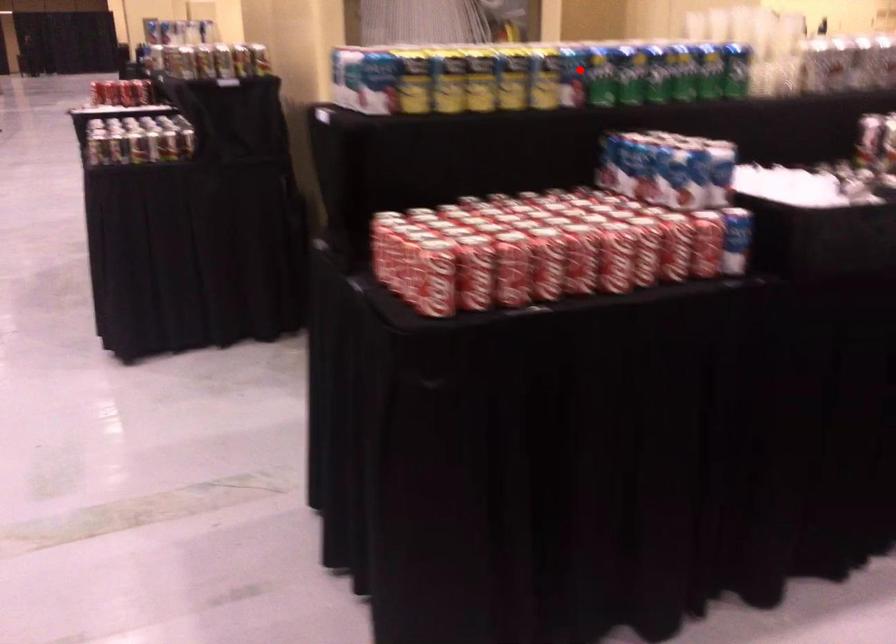
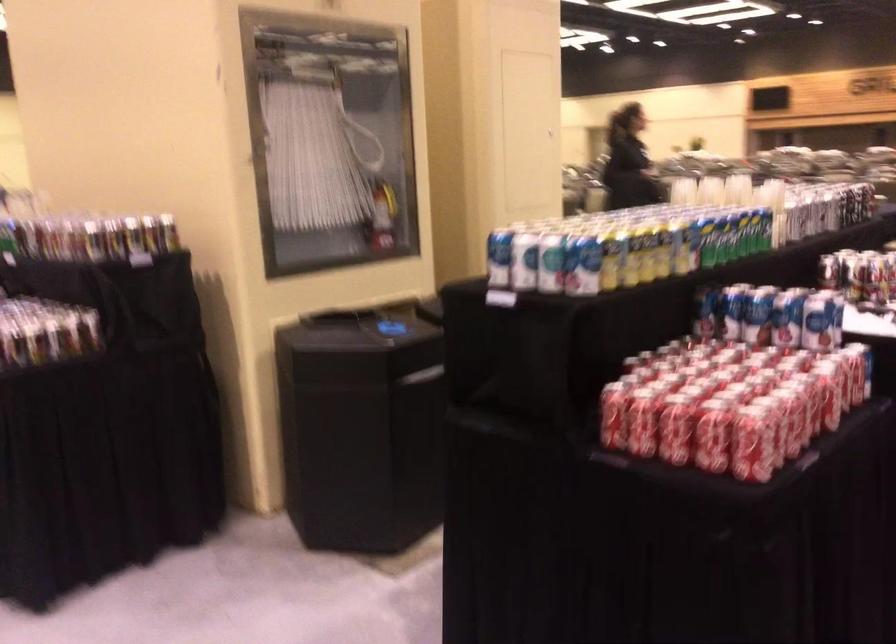
The point at the highlighted location is marked in the first image. Where is the corresponding point in the second image?

(703, 239)